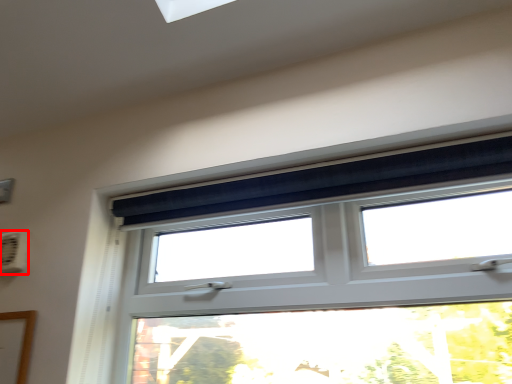
Question: From the image, what is the correct spatial relationship of air conditioning (annotated by the red box) in relation to window?

Choices:
 (A) left
 (B) right

Answer: (A)